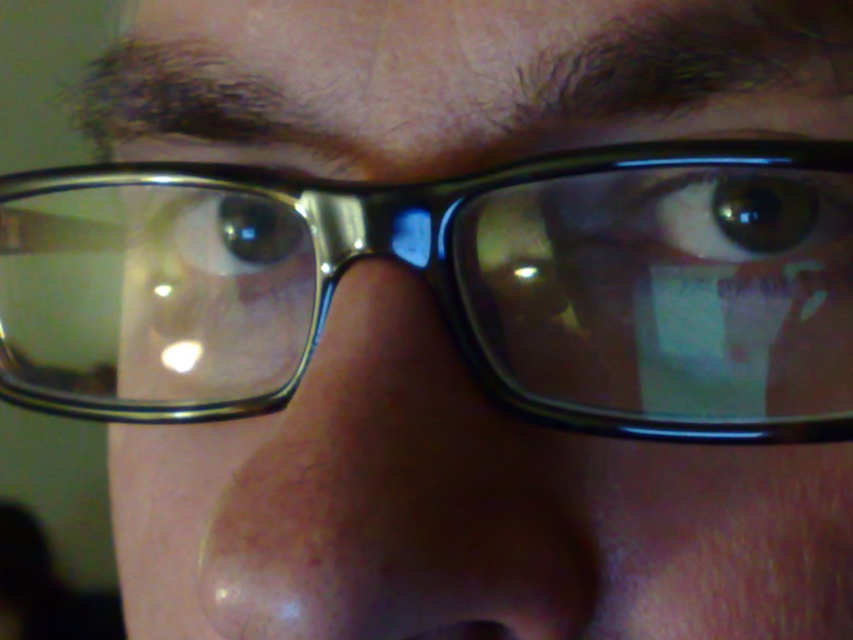
Who is positioned more to the right, clear skin nose at center or green matte eye at center?

green matte eye at center

Is clear skin nose at center to the left of green matte eye at center from the viewer's perspective?

Correct, you'll find clear skin nose at center to the left of green matte eye at center.

Does point (321, 388) come behind point (828, 234)?

No, (321, 388) is in front of (828, 234).

I want to click on clear skin nose at center, so click(390, 496).

Image resolution: width=853 pixels, height=640 pixels. What do you see at coordinates (390, 496) in the screenshot?
I see `clear skin nose at center` at bounding box center [390, 496].

Where is `clear skin nose at center`? clear skin nose at center is located at coordinates (390, 496).

Is clear plastic glasses at center further to the viewer compared to brown glossy eye at center?

No, clear plastic glasses at center is closer to the viewer.

Which is behind, point (495, 321) or point (183, 230)?

Point (183, 230)

Is point (6, 291) farther from viewer compared to point (204, 262)?

Yes.

At what (x,y) coordinates should I click in order to perform the action: click on clear plastic glasses at center. Please return your answer as a coordinate pair (x, y). Image resolution: width=853 pixels, height=640 pixels. Looking at the image, I should click on (450, 285).